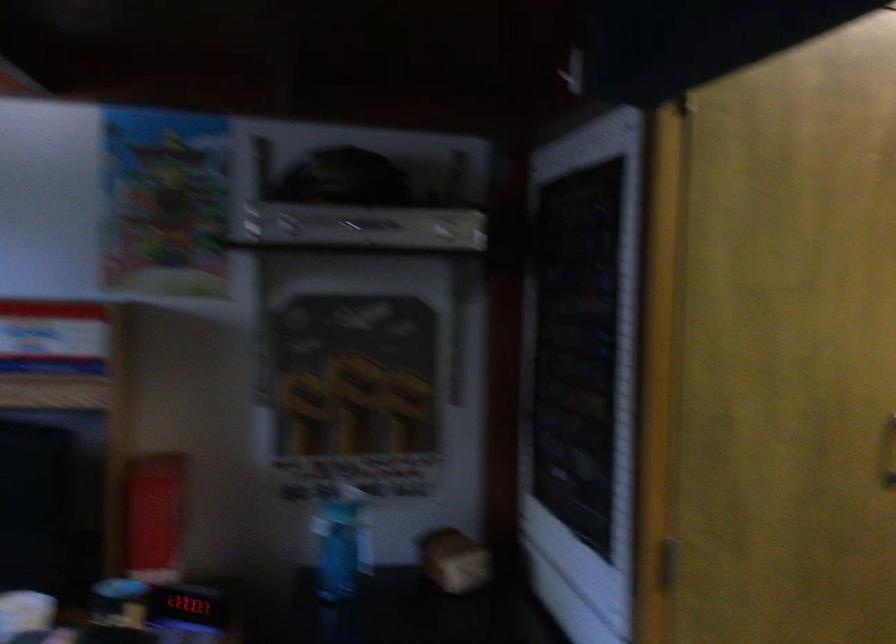
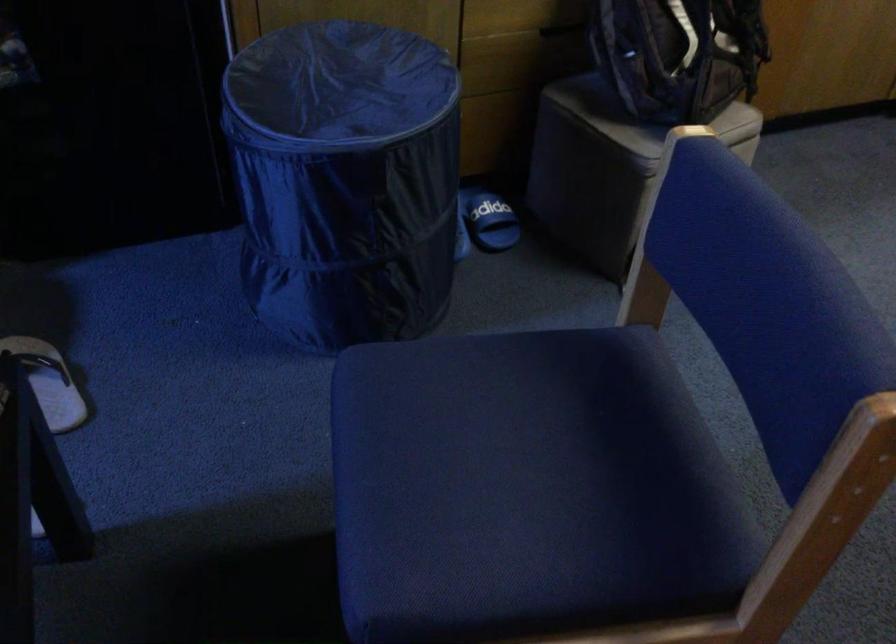
Question: The images are taken continuously from a first-person perspective. In which direction is your viewpoint rotating?

Choices:
 (A) Left
 (B) Right
 (C) Up
 (D) Down

Answer: (D)